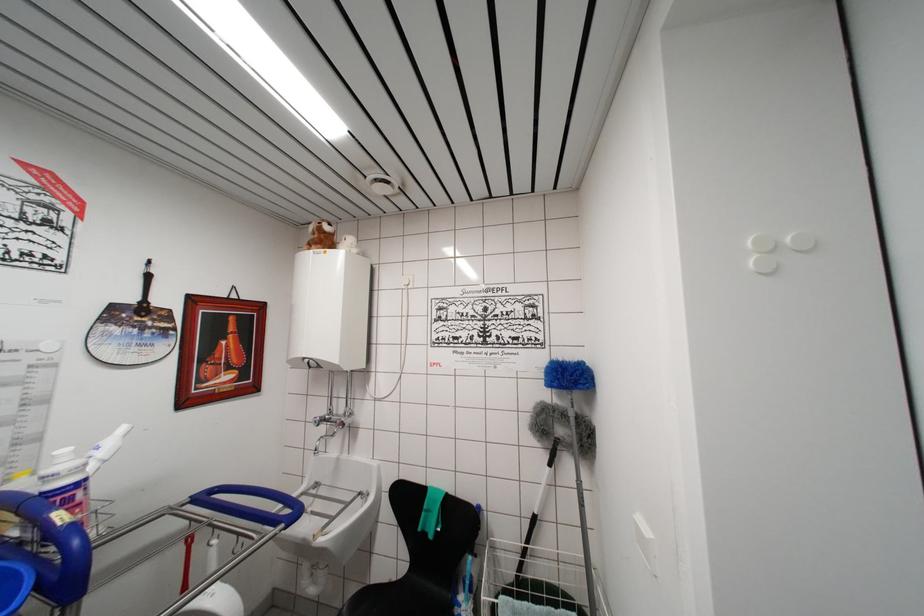
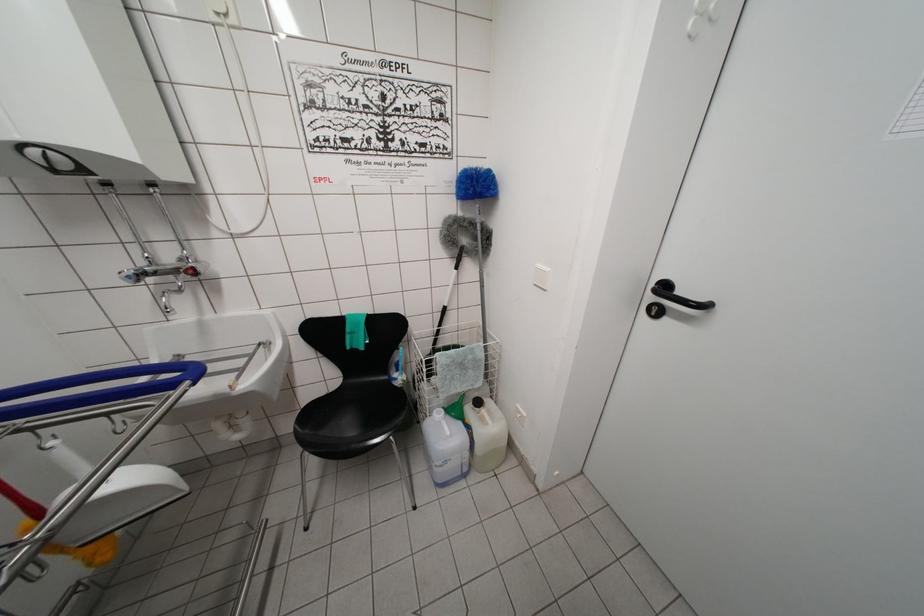
Where in the second image is the point corresponding to pixel 402 583 from the first image?

(335, 395)